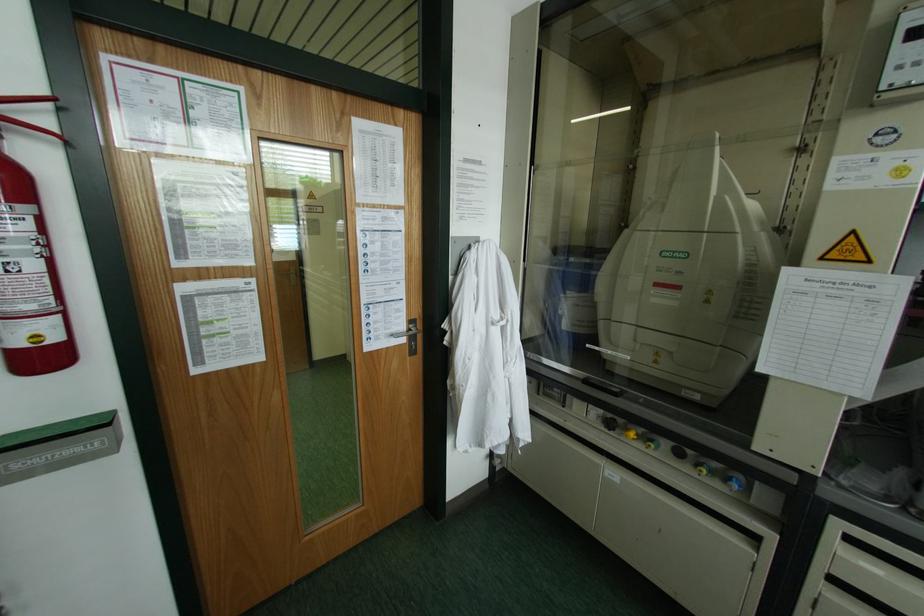
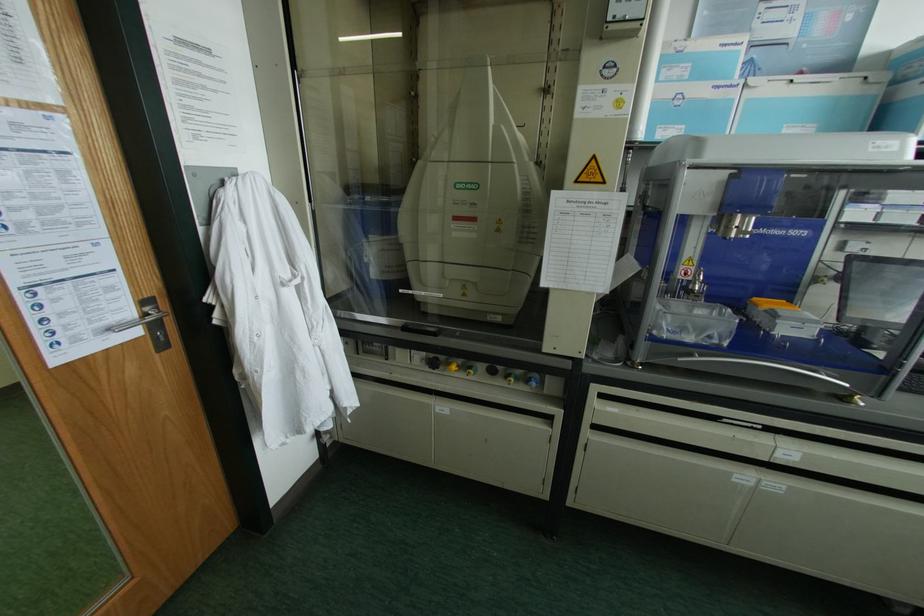
Where in the second image is the point corresponding to point 650,440 from the first image?

(469, 367)